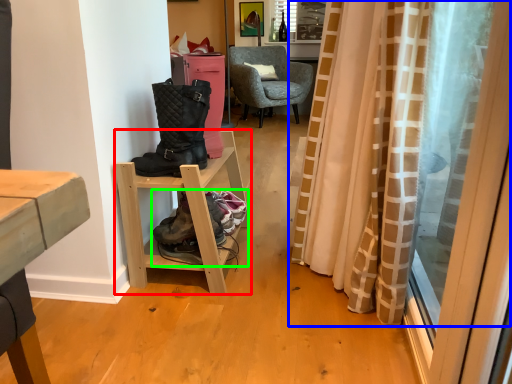
Question: Based on their relative distances, which object is nearer to shelf (highlighted by a red box)? Choose from curtain (highlighted by a blue box) and footwear (highlighted by a green box).

Choices:
 (A) curtain
 (B) footwear

Answer: (B)